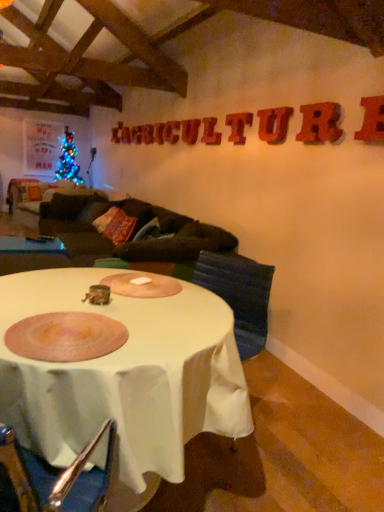
Measure the distance between rubberized red letter at upper right, arranged as the 1th letter when viewed from the front, and camera.

A distance of 7.17 feet exists between rubberized red letter at upper right, arranged as the 1th letter when viewed from the front, and camera.

The height and width of the screenshot is (512, 384). I want to click on wooden textured letter at upper center, which is counted as the fourth letter, starting from the left, so click(x=190, y=131).

What is the approximate width of rubberized red letter u at upper center, the third letter viewed from the front?

The width of rubberized red letter u at upper center, the third letter viewed from the front, is 2.55 inches.

This screenshot has height=512, width=384. I want to click on matte red letter at upper center, which is the fifth letter in right-to-left order, so click(x=210, y=132).

Where is `brown fabric couch at center`? The width and height of the screenshot is (384, 512). brown fabric couch at center is located at coordinates (169, 256).

Where is `wooden letter t at upper center, which is the 6th letter from left to right`? The image size is (384, 512). wooden letter t at upper center, which is the 6th letter from left to right is located at coordinates (238, 126).

At what (x,y) coordinates should I click in order to perform the action: click on rubberized red letter at upper right, placed as the 9th letter when sorted from left to right. Please return your answer as a coordinate pair (x, y). Image resolution: width=384 pixels, height=512 pixels. Looking at the image, I should click on (372, 120).

Is rubberized red letter r at upper right, the 8th letter viewed from the left, positioned far away from rubberized red letter at upper right, which is the first letter in right-to-left order?

Actually, rubberized red letter r at upper right, the 8th letter viewed from the left, and rubberized red letter at upper right, which is the first letter in right-to-left order, are a little close together.

Between rubberized red letter r at upper right, which is counted as the 8th letter, starting from the back, and rubberized red letter at upper right, the ninth letter positioned from the back, which one has smaller size?

rubberized red letter at upper right, the ninth letter positioned from the back.

Considering the positions of point (320, 115) and point (377, 110), is point (320, 115) closer or farther from the camera than point (377, 110)?

Point (320, 115) is positioned farther from the camera compared to point (377, 110).

Is rubberized red letter r at upper right, which is counted as the 8th letter, starting from the back, at the left side of rubberized red letter at upper right, placed as the 9th letter when sorted from left to right?

Correct, you'll find rubberized red letter r at upper right, which is counted as the 8th letter, starting from the back, to the left of rubberized red letter at upper right, placed as the 9th letter when sorted from left to right.

Looking at this image, from the image's perspective, relative to matte red letter at center, which appears as the 3th letter when viewed from the left, is wooden letter at center, acting as the first letter starting from the back, above or below?

wooden letter at center, acting as the first letter starting from the back, is situated higher than matte red letter at center, which appears as the 3th letter when viewed from the left, in the image.

Is wooden letter at center, which is the ninth letter from right to left, not within matte red letter at center, which appears as the 3th letter when viewed from the left?

Yes, wooden letter at center, which is the ninth letter from right to left, is located beyond the bounds of matte red letter at center, which appears as the 3th letter when viewed from the left.

Does wooden letter at center, which appears as the ninth letter when viewed from the front, have a lesser width compared to matte red letter at center, which ranks as the 3th letter in back-to-front order?

Yes.

From a real-world perspective, is wooden letter at center, which is the ninth letter from right to left, physically located above or below matte red letter at center, which is the 7th letter from right to left?

wooden letter at center, which is the ninth letter from right to left, is situated higher than matte red letter at center, which is the 7th letter from right to left, in the real world.

Is white glossy table at lower left, the first table positioned from the top, bigger than blue fabric armchair at center?

Incorrect, white glossy table at lower left, the first table positioned from the top, is not larger than blue fabric armchair at center.

Between white glossy table at lower left, the second table viewed from the front, and blue fabric armchair at center, which one appears on the left side from the viewer's perspective?

white glossy table at lower left, the second table viewed from the front.

Is white glossy table at lower left, the first table positioned from the top, surrounding blue fabric armchair at center?

No, blue fabric armchair at center is located outside of white glossy table at lower left, the first table positioned from the top.

From a real-world perspective, count 2nd tables downward from the blue fabric armchair at center and point to it. Please provide its 2D coordinates.

[(31, 245)]

Looking at this image, between wooden letter t at upper center, placed as the sixth letter when sorted from back to front, and blue fabric armchair at center, which one appears on the right side from the viewer's perspective?

From the viewer's perspective, wooden letter t at upper center, placed as the sixth letter when sorted from back to front, appears more on the right side.

From the picture: Can you confirm if wooden letter t at upper center, which is the 6th letter from left to right, is wider than blue fabric armchair at center?

No.

Are wooden letter t at upper center, marked as the 4th letter in a right-to-left arrangement, and blue fabric armchair at center far apart?

Yes.

Who is taller, wooden letter t at upper center, which ranks as the fourth letter in front-to-back order, or blue fabric armchair at center?

blue fabric armchair at center is taller.

From the picture: From the image's perspective, which one is positioned lower, rubberized red letter r at upper right, which is counted as the 8th letter, starting from the back, or matte red letter at center, the seventh letter from the front?

rubberized red letter r at upper right, which is counted as the 8th letter, starting from the back.

Would you say rubberized red letter r at upper right, the 2th letter from the right, is a long distance from matte red letter at center, which appears as the 3th letter when viewed from the left?

rubberized red letter r at upper right, the 2th letter from the right, is far away from matte red letter at center, which appears as the 3th letter when viewed from the left.

Between rubberized red letter r at upper right, the 8th letter viewed from the left, and matte red letter at center, which is the 7th letter from right to left, which one has larger size?

With larger size is rubberized red letter r at upper right, the 8th letter viewed from the left.

Is the depth of rubberized red letter r at upper right, acting as the 2th letter starting from the front, greater than that of matte red letter at center, which is the 7th letter from right to left?

No, it is not.

Considering the positions of objects rubberized red letter at upper right, placed as the 9th letter when sorted from left to right, and white glossy table at lower left, placed as the second table when sorted from bottom to top, in the image provided, who is more to the right, rubberized red letter at upper right, placed as the 9th letter when sorted from left to right, or white glossy table at lower left, placed as the second table when sorted from bottom to top,?

rubberized red letter at upper right, placed as the 9th letter when sorted from left to right.

Does rubberized red letter at upper right, the ninth letter positioned from the back, have a smaller size compared to white glossy table at lower left, the second table viewed from the front?

Indeed, rubberized red letter at upper right, the ninth letter positioned from the back, has a smaller size compared to white glossy table at lower left, the second table viewed from the front.

Between rubberized red letter at upper right, which is the first letter in right-to-left order, and white glossy table at lower left, the first table positioned from the top, which one has more height?

Standing taller between the two is rubberized red letter at upper right, which is the first letter in right-to-left order.

Is white glossy table at lower left, the first table positioned from the top, surrounded by rubberized red letter at upper right, the ninth letter positioned from the back?

No, white glossy table at lower left, the first table positioned from the top, is not inside rubberized red letter at upper right, the ninth letter positioned from the back.

Which object is closer to the camera taking this photo, rubberized red letter r at upper right, the 2th letter from the right, or wooden textured letter at upper center, which is the 6th letter from front to back?

rubberized red letter r at upper right, the 2th letter from the right.

There is a wooden textured letter at upper center, the 4th letter in the back-to-front sequence. Where is `the 4th letter below it (from the image's perspective)`? The height and width of the screenshot is (512, 384). the 4th letter below it (from the image's perspective) is located at coordinates (320, 123).

What's the angular difference between rubberized red letter r at upper right, acting as the 2th letter starting from the front, and wooden textured letter at upper center, the 4th letter in the back-to-front sequence,'s facing directions?

There is a 0.0164-degree angle between the facing directions of rubberized red letter r at upper right, acting as the 2th letter starting from the front, and wooden textured letter at upper center, the 4th letter in the back-to-front sequence.

From the image's perspective, which letter is the 1st one above the rubberized red letter at upper right, which is the first letter in right-to-left order? Please provide its 2D coordinates.

[(320, 123)]

Find the location of a particular element. The height and width of the screenshot is (512, 384). the 6th letter positioned below the wooden letter at center, which appears as the ninth letter when viewed from the front (from a real-world perspective) is located at coordinates (171, 132).

When comparing their distances from blue fabric armchair at center, does white glossy table at lower left, the second table viewed from the front, or rubberized red letter u at upper center, arranged as the third letter when viewed from the right, seem closer?

rubberized red letter u at upper center, arranged as the third letter when viewed from the right, is closer to blue fabric armchair at center.

Which object lies nearer to the anchor point wooden textured letter at upper center, which is counted as the fourth letter, starting from the left, wooden letter t at upper center, marked as the 4th letter in a right-to-left arrangement, or matte red letter at center, the seventh letter from the front?

matte red letter at center, the seventh letter from the front.

Considering their positions, is rubberized red letter at upper right, the ninth letter positioned from the back, positioned closer to white cloth-covered table at center, placed as the second table when sorted from back to front, than rubberized red letter u at upper center, arranged as the third letter when viewed from the right?

The object closer to white cloth-covered table at center, placed as the second table when sorted from back to front, is rubberized red letter at upper right, the ninth letter positioned from the back.

When comparing their distances from wooden letter t at upper center, marked as the 4th letter in a right-to-left arrangement, does rubberized red letter at upper right, the ninth letter positioned from the back, or matte red letter at upper center, arranged as the 2th letter when viewed from the back, seem closer?

rubberized red letter at upper right, the ninth letter positioned from the back, is positioned closer to the anchor wooden letter t at upper center, marked as the 4th letter in a right-to-left arrangement.

Looking at the image, which one is located closer to matte red letter at upper center, the 5th letter viewed from the front, matte red letter at upper center, arranged as the 2th letter when viewed from the back, or wooden letter t at upper center, placed as the sixth letter when sorted from back to front?

wooden letter t at upper center, placed as the sixth letter when sorted from back to front, lies closer to matte red letter at upper center, the 5th letter viewed from the front, than the other object.

Considering their positions, is rubberized red letter u at upper center, the third letter viewed from the front, positioned further to wooden letter t at upper center, which is the 6th letter from left to right, than matte red letter at upper center, arranged as the 2th letter when viewed from the back?

matte red letter at upper center, arranged as the 2th letter when viewed from the back, lies further to wooden letter t at upper center, which is the 6th letter from left to right, than the other object.

Estimate the real-world distances between objects in this image. Which object is closer to brown fabric couch at center, wooden textured letter at upper center, the 4th letter in the back-to-front sequence, or white cloth-covered table at center, which ranks as the 2th table in left-to-right order?

white cloth-covered table at center, which ranks as the 2th table in left-to-right order, is positioned closer to the anchor brown fabric couch at center.

Based on their spatial positions, is wooden letter at center, which is the ninth letter from right to left, or wooden letter t at upper center, placed as the sixth letter when sorted from back to front, closer to matte red letter at upper center, arranged as the 2th letter when viewed from the back?

wooden letter at center, which is the ninth letter from right to left.

I want to click on armchair between white glossy table at lower left, which ranks as the first table in left-to-right order, and rubberized red letter r at upper right, the 8th letter viewed from the left, so click(x=239, y=295).

At what (x,y) coordinates should I click in order to perform the action: click on armchair between white cloth-covered table at center, positioned as the 1th table in right-to-left order, and matte red letter at center, which is the 7th letter from right to left, in the front-back direction. Please return your answer as a coordinate pair (x, y). This screenshot has width=384, height=512. Looking at the image, I should click on (239, 295).

I want to click on couch between blue fabric armchair at center and wooden letter t at upper center, placed as the sixth letter when sorted from back to front, from front to back, so click(169, 256).

In order to click on couch situated between white glossy table at lower left, the second table viewed from the front, and rubberized red letter r at upper right, which is counted as the 8th letter, starting from the back, from left to right in this screenshot , I will do `click(169, 256)`.